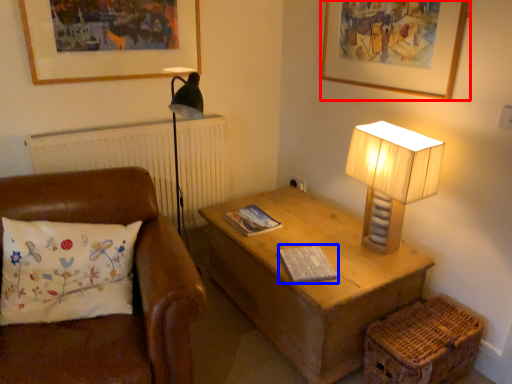
Question: Among these objects, which one is nearest to the camera, picture frame (highlighted by a red box) or magazine (highlighted by a blue box)?

Choices:
 (A) picture frame
 (B) magazine

Answer: (A)